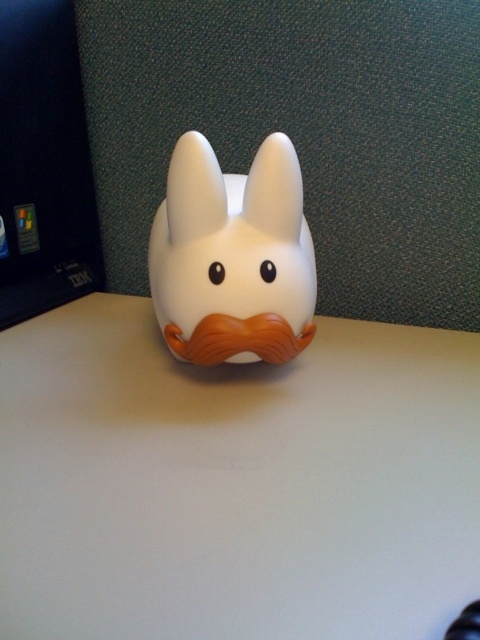
Does point (282, 323) come in front of point (46, 116)?

Yes, it is.

Image resolution: width=480 pixels, height=640 pixels. What do you see at coordinates (232, 257) in the screenshot?
I see `white matte rabbit at center` at bounding box center [232, 257].

Does point (188, 291) lie behind point (11, 296)?

No, (188, 291) is in front of (11, 296).

The width and height of the screenshot is (480, 640). I want to click on white matte rabbit at center, so click(x=232, y=257).

Identify the location of white matte table at center. This screenshot has width=480, height=640. (235, 483).

Who is positioned more to the left, white matte table at center or black plastic laptop at left?

Positioned to the left is black plastic laptop at left.

Does point (368, 349) come behind point (62, 49)?

No.

Locate an element on the screen. Image resolution: width=480 pixels, height=640 pixels. white matte table at center is located at coordinates (235, 483).

Is white matte table at center above white matte rabbit at center?

No, white matte table at center is not above white matte rabbit at center.

Locate an element on the screen. The width and height of the screenshot is (480, 640). white matte table at center is located at coordinates (235, 483).

Where is `white matte table at center`? white matte table at center is located at coordinates pyautogui.click(x=235, y=483).